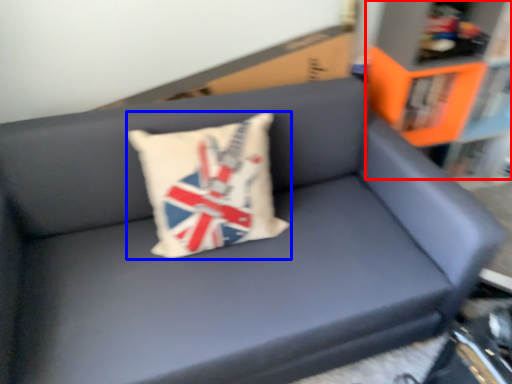
Question: Which object appears closest to the camera in this image, bookcase (highlighted by a red box) or pillow (highlighted by a blue box)?

Choices:
 (A) bookcase
 (B) pillow

Answer: (B)